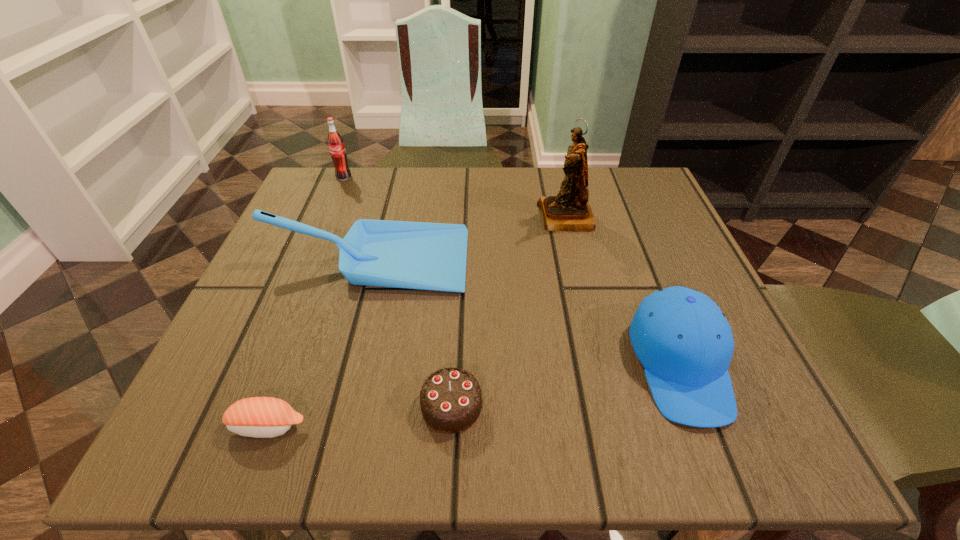
Locate an element on the screen. The height and width of the screenshot is (540, 960). vacant point located between the chocolate cake and the fifth shortest object is located at coordinates (397, 292).

Find the location of a particular element. The width and height of the screenshot is (960, 540). object that is the second closest to the figurine is located at coordinates coord(684,342).

Locate which object is the third closest to the fifth shortest object. Please provide its 2D coordinates. Your answer should be formatted as a tuple, i.e. [(x, y)], where the tuple contains the x and y coordinates of a point satisfying the conditions above.

[(450, 399)]

What are the coordinates of `free region that satisfies the following two spatial constraints: 1. on the front side of the dustpan; 2. on the left side of the second shortest object` in the screenshot? It's located at (329, 406).

Where is `vacant position in the image that satisfies the following two spatial constraints: 1. on the front-facing side of the tallest object; 2. on the front side of the second shortest object`? vacant position in the image that satisfies the following two spatial constraints: 1. on the front-facing side of the tallest object; 2. on the front side of the second shortest object is located at coordinates (611, 406).

Where is `vacant space that satisfies the following two spatial constraints: 1. on the label of the dustpan; 2. on the right side of the farthest object`? vacant space that satisfies the following two spatial constraints: 1. on the label of the dustpan; 2. on the right side of the farthest object is located at coordinates (309, 260).

The image size is (960, 540). I want to click on vacant region that satisfies the following two spatial constraints: 1. on the front-facing side of the tallest object; 2. on the front side of the fifth tallest object, so click(x=611, y=406).